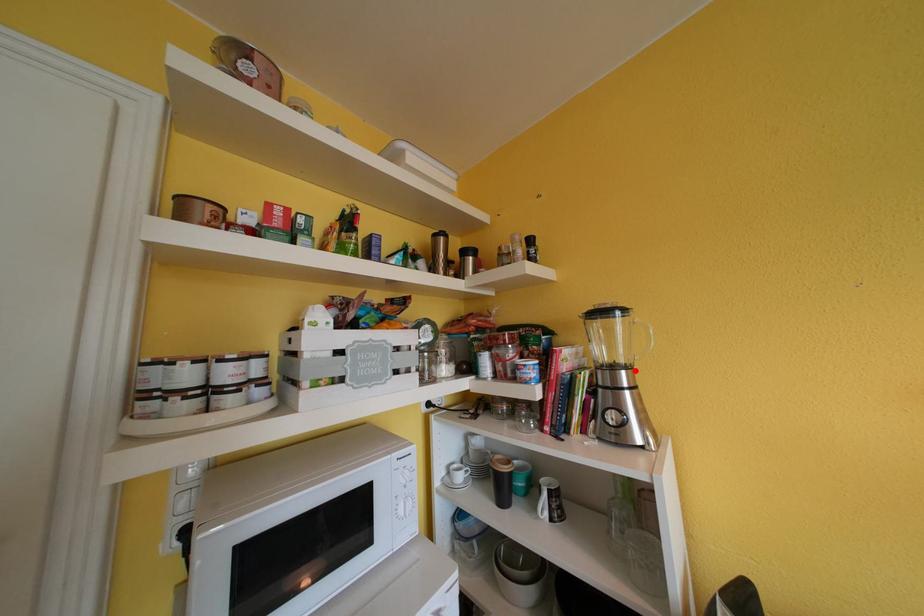
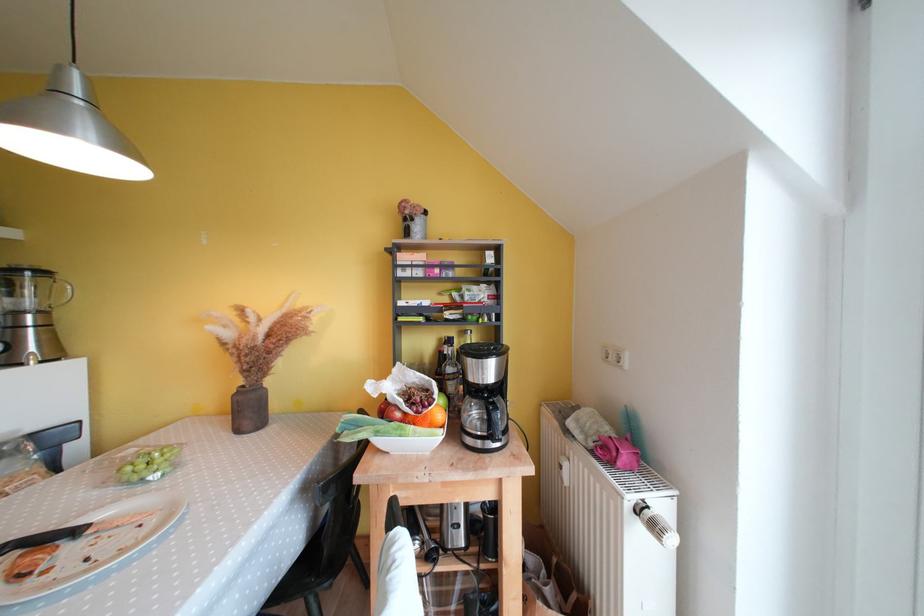
The point at the highlighted location is marked in the first image. Where is the corresponding point in the second image?

(49, 315)